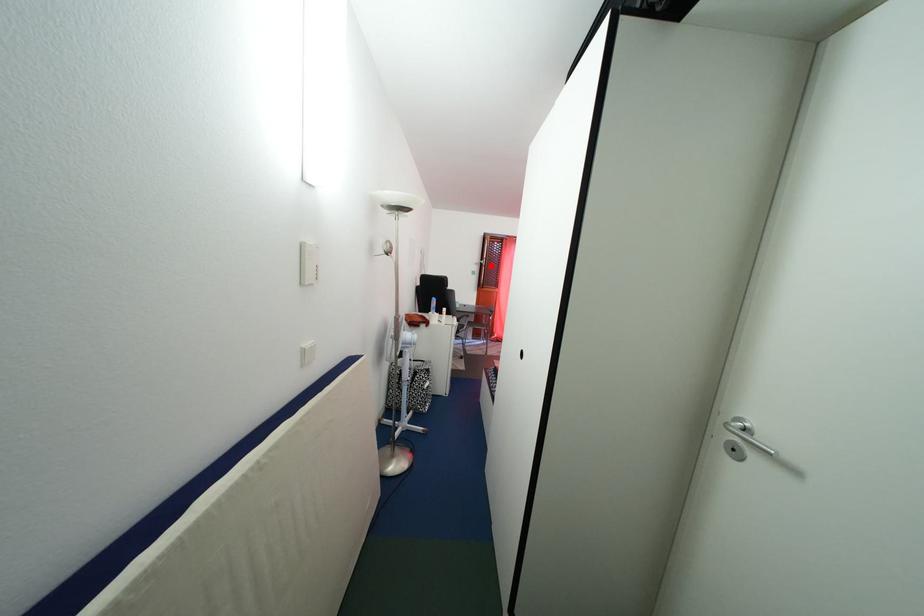
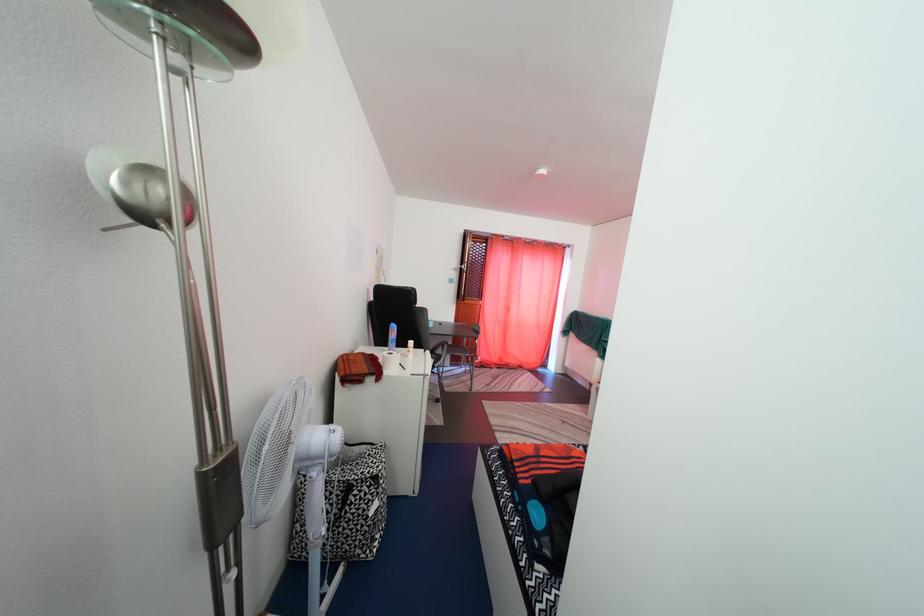
In the second image, find the point that corresponds to the highlighted location in the first image.

(470, 270)